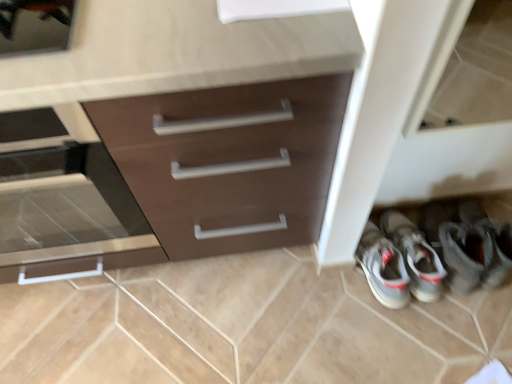
Question: Is gray fabric sneakers at lower right looking in the opposite direction of matte brown drawer at left?

Choices:
 (A) yes
 (B) no

Answer: (B)

Question: From a real-world perspective, is gray fabric sneakers at lower right positioned under matte brown drawer at left based on gravity?

Choices:
 (A) yes
 (B) no

Answer: (A)

Question: Considering the relative sizes of gray fabric sneakers at lower right and matte brown drawer at left in the image provided, is gray fabric sneakers at lower right wider than matte brown drawer at left?

Choices:
 (A) yes
 (B) no

Answer: (B)

Question: From the image's perspective, is gray fabric sneakers at lower right above matte brown drawer at left?

Choices:
 (A) yes
 (B) no

Answer: (B)

Question: From a real-world perspective, is gray fabric sneakers at lower right located higher than matte brown drawer at left?

Choices:
 (A) yes
 (B) no

Answer: (B)

Question: Is brown matte cabinet at center to the left or to the right of matte brown drawer at left in the image?

Choices:
 (A) right
 (B) left

Answer: (A)

Question: From a real-world perspective, relative to matte brown drawer at left, is brown matte cabinet at center vertically above or below?

Choices:
 (A) above
 (B) below

Answer: (B)

Question: Is brown matte cabinet at center in front of or behind matte brown drawer at left in the image?

Choices:
 (A) front
 (B) behind

Answer: (A)

Question: In terms of height, does brown matte cabinet at center look taller or shorter compared to matte brown drawer at left?

Choices:
 (A) short
 (B) tall

Answer: (B)

Question: Considering the positions of gray fabric sneakers at lower right and brown matte cabinet at center in the image, is gray fabric sneakers at lower right wider or thinner than brown matte cabinet at center?

Choices:
 (A) wide
 (B) thin

Answer: (B)

Question: From the image's perspective, is gray fabric sneakers at lower right above or below brown matte cabinet at center?

Choices:
 (A) above
 (B) below

Answer: (B)

Question: From a real-world perspective, relative to brown matte cabinet at center, is gray fabric sneakers at lower right vertically above or below?

Choices:
 (A) below
 (B) above

Answer: (A)

Question: In terms of size, does gray fabric sneakers at lower right appear bigger or smaller than brown matte cabinet at center?

Choices:
 (A) small
 (B) big

Answer: (A)

Question: From a real-world perspective, is brown matte cabinet at center physically located above or below gray fabric sneakers at lower right?

Choices:
 (A) above
 (B) below

Answer: (A)

Question: Considering the positions of point (95, 28) and point (393, 246), is point (95, 28) closer or farther from the camera than point (393, 246)?

Choices:
 (A) farther
 (B) closer

Answer: (B)